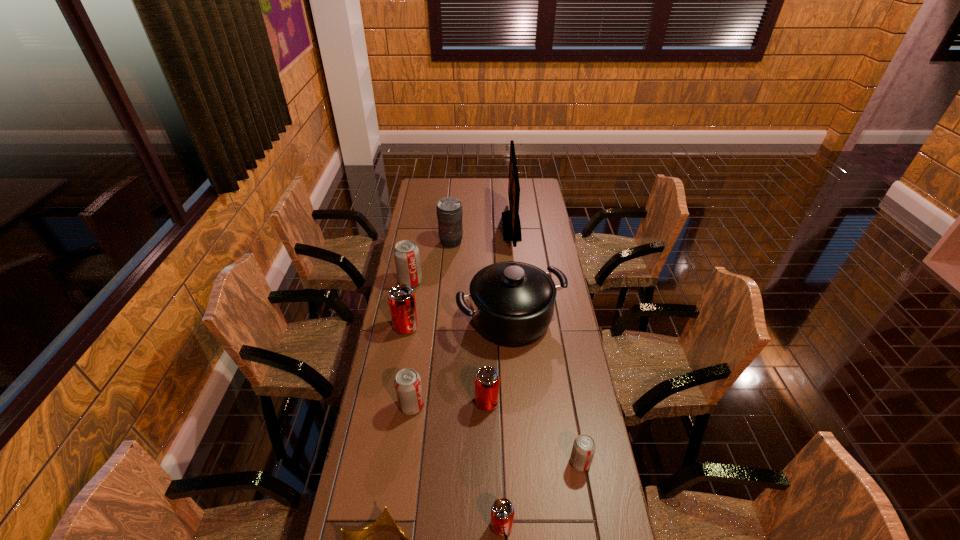
Identify which soda can is the fourth nearest to the farthest gray soda can. Please provide its 2D coordinates. Your answer should be formatted as a tuple, i.e. [(x, y)], where the tuple contains the x and y coordinates of a point satisfying the conditions above.

[(583, 450)]

Identify which soda can is located as the fourth nearest to the telephoto lens. Please provide its 2D coordinates. Your answer should be formatted as a tuple, i.e. [(x, y)], where the tuple contains the x and y coordinates of a point satisfying the conditions above.

[(408, 387)]

Find the location of a particular element. The height and width of the screenshot is (540, 960). the second closest red soda can to the second farthest soda can is located at coordinates tap(502, 511).

The height and width of the screenshot is (540, 960). I want to click on red soda can that is the second nearest to the biggest red soda can, so click(502, 511).

Identify which gray soda can is located as the nearest to the eighth nearest object. Please provide its 2D coordinates. Your answer should be formatted as a tuple, i.e. [(x, y)], where the tuple contains the x and y coordinates of a point satisfying the conditions above.

[(408, 387)]

Identify the location of gray soda can that is the closest one to the black saucepan. The image size is (960, 540). (406, 253).

Locate an element on the screen. This screenshot has height=540, width=960. vacant space that satisfies the following two spatial constraints: 1. on the front side of the second nearest gray soda can; 2. on the left side of the nearest soda can is located at coordinates (396, 526).

Identify the location of vacant space that satisfies the following two spatial constraints: 1. on the front side of the second biggest red soda can; 2. on the right side of the rightmost gray soda can. This screenshot has width=960, height=540. (488, 462).

Where is `free region that satisfies the following two spatial constraints: 1. on the front-facing side of the nearest gray soda can; 2. on the right side of the monitor`? Image resolution: width=960 pixels, height=540 pixels. free region that satisfies the following two spatial constraints: 1. on the front-facing side of the nearest gray soda can; 2. on the right side of the monitor is located at coordinates (534, 462).

The image size is (960, 540). What are the coordinates of `blank area in the image that satisfies the following two spatial constraints: 1. on the front side of the second nearest red soda can; 2. on the left side of the third nearest object` in the screenshot? It's located at (488, 462).